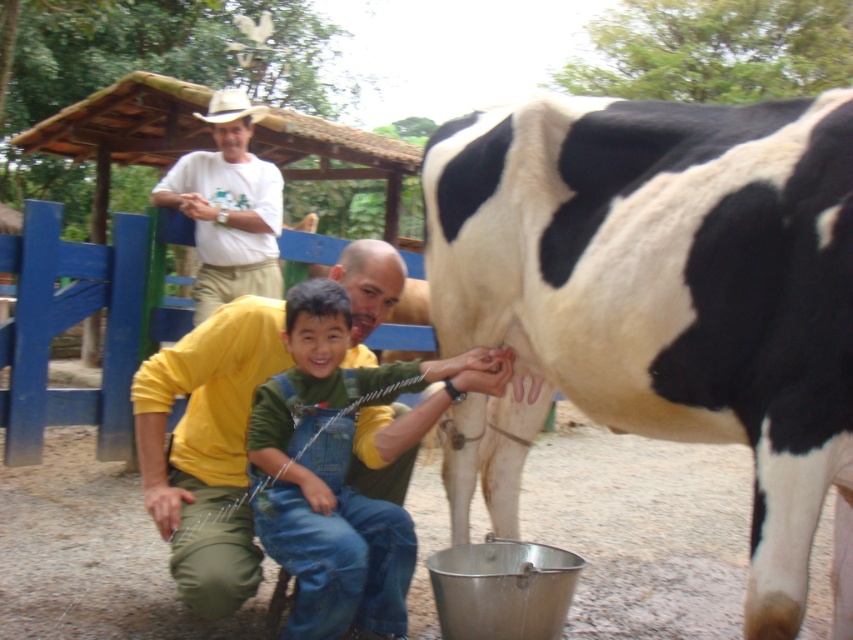
You are standing at the point labeled point (218,198) and want to walk to the cow on the right side of the frame. Will you pass by point (262,493) on your way there?

Yes, because point (262,493) is in front of point (218,198), so walking towards the cow on the right side of the frame would require passing through point (262,493) first.

You are a tailor observing the clothing items in the image. You need to determine which clothing item has a larger width between the green denim overalls at center and the white cotton shirt at upper center. Which one is wider?

The green denim overalls at center has a greater width than the white cotton shirt at upper center, as stated in the description.